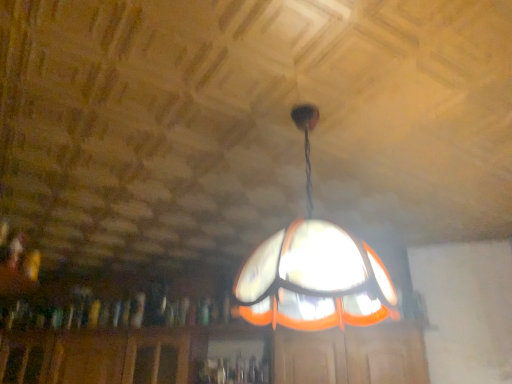
Describe the element at coordinates (314, 270) in the screenshot. I see `translucent glass lampshade at center` at that location.

Identify the location of translucent glass lampshade at center. The width and height of the screenshot is (512, 384). (314, 270).

At what (x,y) coordinates should I click in order to perform the action: click on translucent glass lampshade at center. Please return your answer as a coordinate pair (x, y). Looking at the image, I should click on (314, 270).